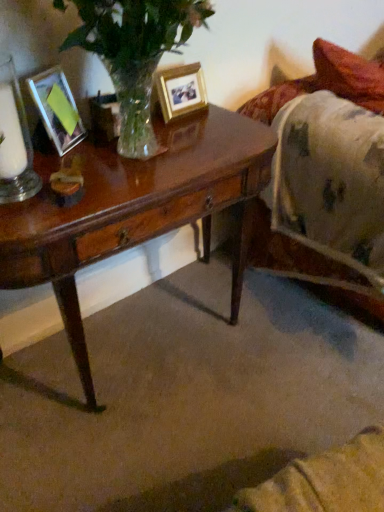
Describe the element at coordinates (326, 82) in the screenshot. I see `fluffy white blanket at right` at that location.

The image size is (384, 512). I want to click on shiny brown wood desk at center, so click(x=134, y=210).

This screenshot has height=512, width=384. What do you see at coordinates (51, 110) in the screenshot?
I see `matte glass picture frame at left, marked as the first picture frame in a front-to-back arrangement` at bounding box center [51, 110].

You are a GUI agent. You are given a task and a screenshot of the screen. Output one action in this format:
    pyautogui.click(x=<x>, y=<y>)
    Task: Click on the gold metallic photo frame at upper center, which is counted as the first picture frame, starting from the right
    
    Given the screenshot: What is the action you would take?
    pyautogui.click(x=181, y=91)

Measure the distance between gold metallic photo frame at upper center, which ranks as the 2th picture frame in left-to-right order, and camera.

4.39 feet.

Locate an element on the screen. The height and width of the screenshot is (512, 384). clear glass candle holder at left is located at coordinates tap(14, 140).

In terms of height, does white wax candle at left look taller or shorter compared to matte glass picture frame at left, marked as the first picture frame in a front-to-back arrangement?

In the image, white wax candle at left appears to be taller than matte glass picture frame at left, marked as the first picture frame in a front-to-back arrangement.

Is the position of white wax candle at left less distant than that of matte glass picture frame at left, marked as the first picture frame in a front-to-back arrangement?

Yes.

At what (x,y) coordinates should I click in order to perform the action: click on the 1st picture frame above the white wax candle at left (from the image's perspective). Please return your answer as a coordinate pair (x, y). Image resolution: width=384 pixels, height=512 pixels. Looking at the image, I should click on (51, 110).

Considering their positions, is shiny brown wood desk at center located in front of or behind gold metallic photo frame at upper center, positioned as the first picture frame in back-to-front order?

Visually, shiny brown wood desk at center is located in front of gold metallic photo frame at upper center, positioned as the first picture frame in back-to-front order.

Which object is wider, shiny brown wood desk at center or gold metallic photo frame at upper center, which ranks as the 2th picture frame in left-to-right order?

With larger width is shiny brown wood desk at center.

Is shiny brown wood desk at center positioned with its back to gold metallic photo frame at upper center, which is counted as the first picture frame, starting from the right?

No, shiny brown wood desk at center's orientation is not away from gold metallic photo frame at upper center, which is counted as the first picture frame, starting from the right.

Does point (3, 117) come behind point (19, 95)?

No, (3, 117) is in front of (19, 95).

From the image's perspective, is white wax candle at left below clear glass candle holder at left?

Incorrect, from the image's perspective, white wax candle at left is higher than clear glass candle holder at left.

Is white wax candle at left outside of clear glass candle holder at left?

Yes, white wax candle at left is located beyond the bounds of clear glass candle holder at left.

Visually, is white wax candle at left positioned to the left or to the right of clear glass candle holder at left?

white wax candle at left is to the left of clear glass candle holder at left.

From a real-world perspective, does clear glass candle holder at left stand above shiny brown wood desk at center?

Yes, from a real-world perspective, clear glass candle holder at left is on top of shiny brown wood desk at center.

Is clear glass candle holder at left positioned in front of shiny brown wood desk at center?

No, the depth of clear glass candle holder at left is greater than that of shiny brown wood desk at center.

Is point (8, 141) positioned in front of point (226, 199)?

Yes, it is in front of point (226, 199).

Is clear glass candle holder at left facing away from shiny brown wood desk at center?

No, clear glass candle holder at left is not facing away from shiny brown wood desk at center.

Would you say white wax candle at left is part of matte glass picture frame at left, which is the first picture frame in left-to-right order,'s contents?

That's incorrect, white wax candle at left is not inside matte glass picture frame at left, which is the first picture frame in left-to-right order.

Which object is positioned more to the right, matte glass picture frame at left, marked as the first picture frame in a front-to-back arrangement, or white wax candle at left?

matte glass picture frame at left, marked as the first picture frame in a front-to-back arrangement, is more to the right.

Who is more distant, matte glass picture frame at left, which is the first picture frame in left-to-right order, or white wax candle at left?

matte glass picture frame at left, which is the first picture frame in left-to-right order, is further from the camera.

Is matte glass picture frame at left, marked as the first picture frame in a front-to-back arrangement, taller than white wax candle at left?

No.

Is white wax candle at left closer to camera compared to fluffy white blanket at right?

Yes, it is.

You are a GUI agent. You are given a task and a screenshot of the screen. Output one action in this format:
    pyautogui.click(x=<x>, y=<y>)
    Task: Click on the bed behind the white wax candle at left
    Image resolution: width=384 pixels, height=512 pixels.
    Given the screenshot: What is the action you would take?
    pyautogui.click(x=326, y=82)

From the image's perspective, which is below, white wax candle at left or fluffy white blanket at right?

From the image's view, white wax candle at left is below.

In terms of height, does white wax candle at left look taller or shorter compared to fluffy white blanket at right?

white wax candle at left is shorter than fluffy white blanket at right.

Is gold metallic photo frame at upper center, positioned as the first picture frame in back-to-front order, looking in the opposite direction of fluffy white blanket at right?

No, gold metallic photo frame at upper center, positioned as the first picture frame in back-to-front order,'s orientation is not away from fluffy white blanket at right.

Based on the photo, can you tell me how much gold metallic photo frame at upper center, which ranks as the 2th picture frame in front-to-back order, and fluffy white blanket at right differ in facing direction?

The angle between the facing direction of gold metallic photo frame at upper center, which ranks as the 2th picture frame in front-to-back order, and the facing direction of fluffy white blanket at right is 5.63 degrees.

Between gold metallic photo frame at upper center, which ranks as the 2th picture frame in front-to-back order, and fluffy white blanket at right, which one has more height?

fluffy white blanket at right.

Can you confirm if gold metallic photo frame at upper center, which ranks as the 2th picture frame in left-to-right order, is thinner than fluffy white blanket at right?

Indeed, gold metallic photo frame at upper center, which ranks as the 2th picture frame in left-to-right order, has a lesser width compared to fluffy white blanket at right.

Where is `candle above the matte glass picture frame at left, the second picture frame positioned from the right (from a real-world perspective)`? The height and width of the screenshot is (512, 384). candle above the matte glass picture frame at left, the second picture frame positioned from the right (from a real-world perspective) is located at coordinates click(x=11, y=136).

Locate an element on the screen. The image size is (384, 512). picture frame located on the right of shiny brown wood desk at center is located at coordinates (181, 91).

From the image, which object appears to be nearer to fluffy white blanket at right, white wax candle at left or shiny brown wood desk at center?

shiny brown wood desk at center is closer to fluffy white blanket at right.

Estimate the real-world distances between objects in this image. Which object is closer to matte glass picture frame at left, the second picture frame positioned from the right, fluffy white blanket at right or white wax candle at left?

The object closer to matte glass picture frame at left, the second picture frame positioned from the right, is white wax candle at left.

Based on their spatial positions, is gold metallic photo frame at upper center, which ranks as the 2th picture frame in left-to-right order, or fluffy white blanket at right closer to clear glass candle holder at left?

Among the two, gold metallic photo frame at upper center, which ranks as the 2th picture frame in left-to-right order, is located nearer to clear glass candle holder at left.

Looking at the image, which one is located closer to gold metallic photo frame at upper center, which ranks as the 2th picture frame in left-to-right order, fluffy white blanket at right or matte glass picture frame at left, the second picture frame positioned from the right?

matte glass picture frame at left, the second picture frame positioned from the right, lies closer to gold metallic photo frame at upper center, which ranks as the 2th picture frame in left-to-right order, than the other object.

Consider the image. Considering their positions, is shiny brown wood desk at center positioned closer to clear glass candle holder at left than matte glass picture frame at left, which is the first picture frame in left-to-right order?

The object closer to clear glass candle holder at left is matte glass picture frame at left, which is the first picture frame in left-to-right order.

From the image, which object appears to be farther from white wax candle at left, shiny brown wood desk at center or fluffy white blanket at right?

fluffy white blanket at right is positioned further to the anchor white wax candle at left.

Estimate the real-world distances between objects in this image. Which object is closer to gold metallic photo frame at upper center, which is counted as the first picture frame, starting from the right, white wax candle at left or fluffy white blanket at right?

white wax candle at left is closer to gold metallic photo frame at upper center, which is counted as the first picture frame, starting from the right.

Looking at this image, when comparing their distances from matte glass picture frame at left, the second picture frame positioned from the right, does white wax candle at left or fluffy white blanket at right seem further?

fluffy white blanket at right is further to matte glass picture frame at left, the second picture frame positioned from the right.

At what (x,y) coordinates should I click in order to perform the action: click on candle between matte glass picture frame at left, which is the first picture frame in left-to-right order, and shiny brown wood desk at center vertically. Please return your answer as a coordinate pair (x, y). Looking at the image, I should click on (11, 136).

This screenshot has width=384, height=512. Find the location of `picture frame between white wax candle at left and gold metallic photo frame at upper center, which ranks as the 2th picture frame in front-to-back order, in the horizontal direction`. picture frame between white wax candle at left and gold metallic photo frame at upper center, which ranks as the 2th picture frame in front-to-back order, in the horizontal direction is located at coordinates (51, 110).

Where is `desk between white wax candle at left and fluffy white blanket at right from left to right`? desk between white wax candle at left and fluffy white blanket at right from left to right is located at coordinates point(134,210).

Where is `picture frame between gold metallic photo frame at upper center, which ranks as the 2th picture frame in left-to-right order, and shiny brown wood desk at center from top to bottom`? The width and height of the screenshot is (384, 512). picture frame between gold metallic photo frame at upper center, which ranks as the 2th picture frame in left-to-right order, and shiny brown wood desk at center from top to bottom is located at coordinates (51, 110).